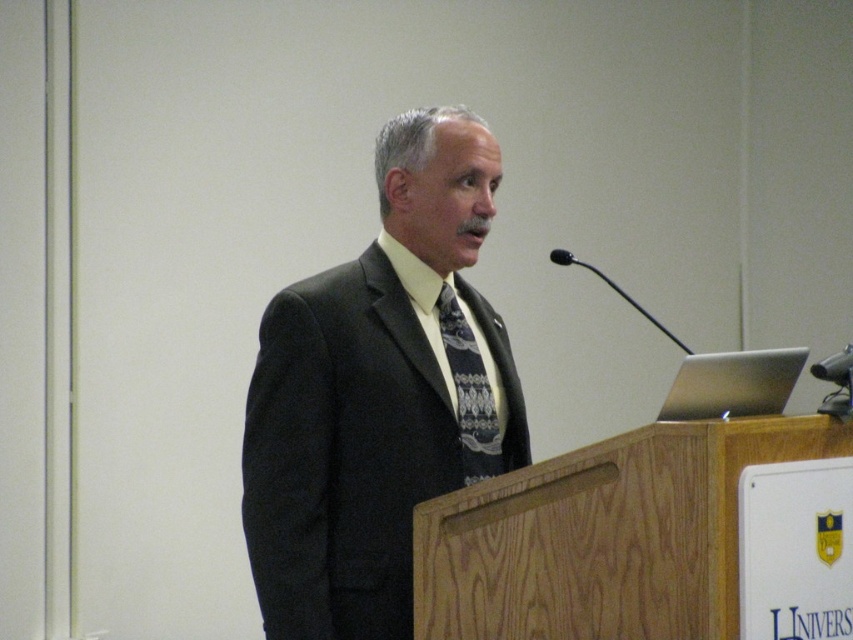
Which is more to the right, dark gray suit at center or dark blue textured tie at center?

dark blue textured tie at center is more to the right.

Is dark gray suit at center above dark blue textured tie at center?

Indeed, dark gray suit at center is positioned over dark blue textured tie at center.

Find the location of a particular element. dark gray suit at center is located at coordinates (378, 394).